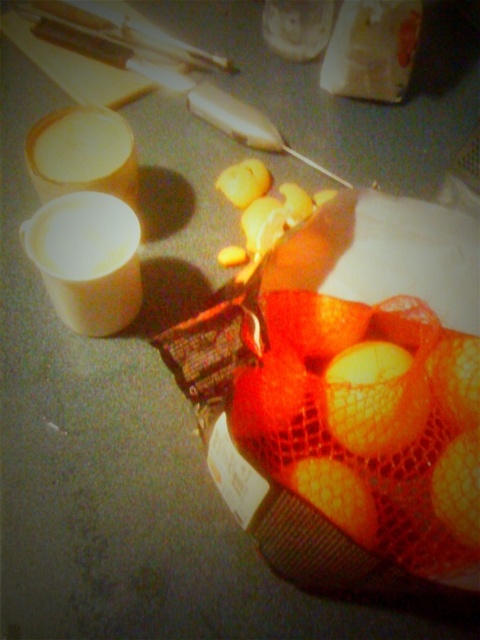
Is orange netted bag at center further to the viewer compared to orange mesh bag at center?

No, orange netted bag at center is in front of orange mesh bag at center.

Image resolution: width=480 pixels, height=640 pixels. What do you see at coordinates (458, 486) in the screenshot?
I see `orange netted bag at center` at bounding box center [458, 486].

In order to click on orange netted bag at center in this screenshot , I will do `click(458, 486)`.

Is yellow mesh bag at center below orange netted bag at center?

No, yellow mesh bag at center is not below orange netted bag at center.

Which is more to the right, yellow mesh bag at center or orange netted bag at center?

orange netted bag at center is more to the right.

Between point (336, 442) and point (437, 461), which one is positioned behind?

The point (336, 442) is behind.

Identify the location of yellow mesh bag at center. Image resolution: width=480 pixels, height=640 pixels. coord(370,422).

Who is more forward, (321, 492) or (443, 332)?

Positioned in front is point (321, 492).

Measure the distance between orange matte mesh bag at center and camera.

The distance of orange matte mesh bag at center from camera is 28.40 inches.

Is point (282, 472) more distant than point (452, 403)?

No.

Identify the location of orange matte mesh bag at center. The width and height of the screenshot is (480, 640). (335, 496).